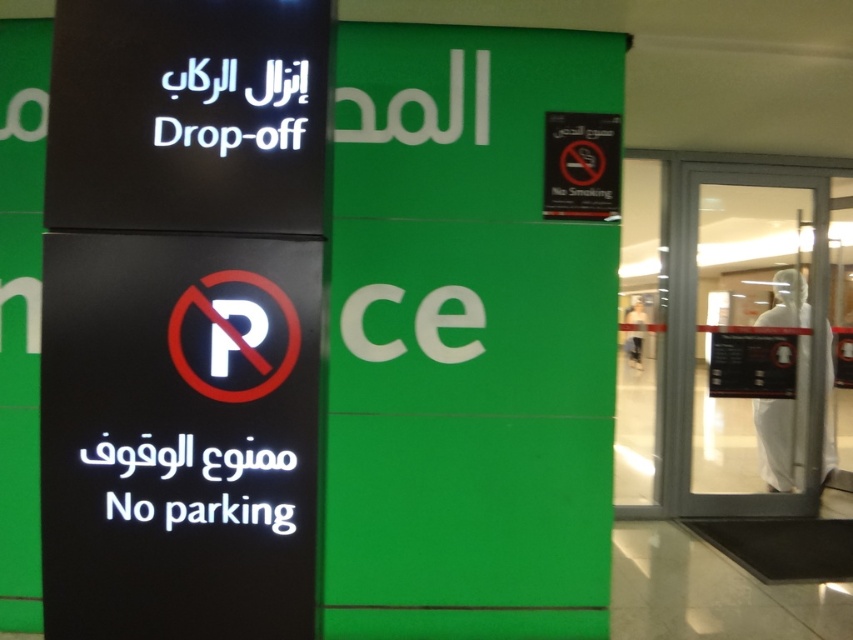
This screenshot has width=853, height=640. I want to click on black glossy sign at center, so click(178, 435).

Does black glossy sign at center lie behind black glossy sign at upper left?

Yes.

Does point (263, 586) come behind point (242, 120)?

Yes, point (263, 586) is farther from viewer.

Find the location of a particular element. The image size is (853, 640). black glossy sign at center is located at coordinates (178, 435).

Who is higher up, black glossy sign at upper left or black plastic sign at upper right?

black plastic sign at upper right is above.

Describe the element at coordinates (187, 115) in the screenshot. I see `black glossy sign at upper left` at that location.

The image size is (853, 640). Find the location of `black glossy sign at upper left`. black glossy sign at upper left is located at coordinates pyautogui.click(x=187, y=115).

Who is lower down, black glossy sign at center or black plastic sign at upper right?

black glossy sign at center

What do you see at coordinates (178, 435) in the screenshot?
I see `black glossy sign at center` at bounding box center [178, 435].

The image size is (853, 640). I want to click on black glossy sign at center, so click(178, 435).